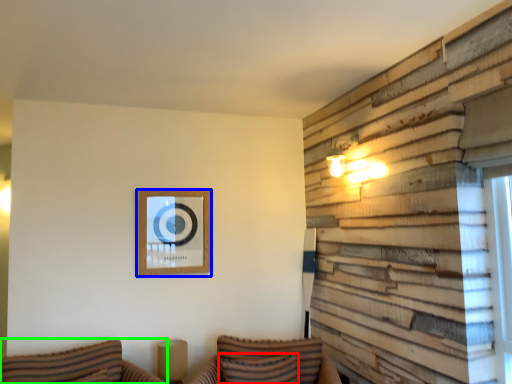
Question: Which object is positioned closest to pillow (highlighted by a red box)? Select from picture frame (highlighted by a blue box) and couch (highlighted by a green box).

Choices:
 (A) picture frame
 (B) couch

Answer: (B)